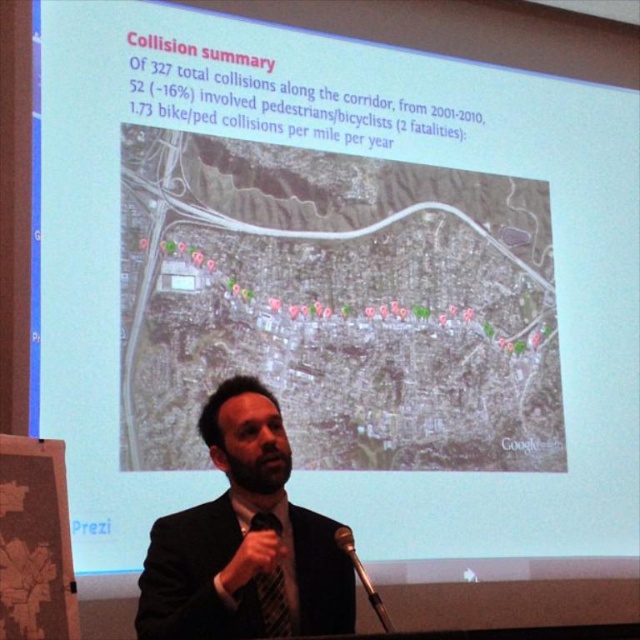
Question: Estimate the real-world distances between objects in this image. Which object is farther from the black suit at center?

Choices:
 (A) metallic silver microphone at lower center
 (B) black satin tie at lower center

Answer: (A)

Question: Is black suit at center above metallic silver microphone at lower center?

Choices:
 (A) no
 (B) yes

Answer: (B)

Question: Which of these objects is positioned closest to the black suit at center?

Choices:
 (A) black satin tie at lower center
 (B) metallic silver microphone at lower center

Answer: (A)

Question: Is black satin tie at lower center to the right of metallic silver microphone at lower center from the viewer's perspective?

Choices:
 (A) no
 (B) yes

Answer: (A)

Question: Is black suit at center positioned in front of black satin tie at lower center?

Choices:
 (A) yes
 (B) no

Answer: (A)

Question: Estimate the real-world distances between objects in this image. Which object is farther from the black satin tie at lower center?

Choices:
 (A) metallic silver microphone at lower center
 (B) black suit at center

Answer: (A)